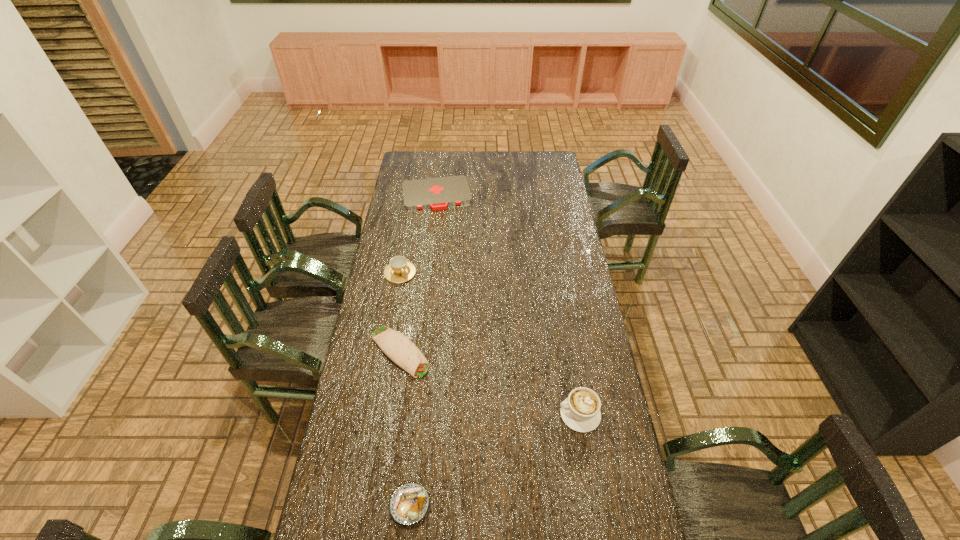
The height and width of the screenshot is (540, 960). What are the coordinates of `pastry` in the screenshot? It's located at (409, 503).

The width and height of the screenshot is (960, 540). In order to click on cappuccino in this screenshot , I will do `click(580, 411)`.

This screenshot has height=540, width=960. What are the coordinates of `the tallest object` in the screenshot? It's located at (580, 411).

Identify the location of the shortest object. The height and width of the screenshot is (540, 960). (438, 193).

Locate an element on the screen. the farthest object is located at coordinates (438, 193).

Locate an element on the screen. The width and height of the screenshot is (960, 540). burrito is located at coordinates (396, 346).

Locate an element on the screen. the fourth nearest object is located at coordinates (399, 270).

At what (x,y) coordinates should I click in order to perform the action: click on cup. Please return your answer as a coordinate pair (x, y). Looking at the image, I should click on (399, 270).

Locate an element on the screen. free space located on the right of the pastry is located at coordinates (492, 505).

What are the coordinates of `vacant space located 0.340m to the right of the cappuccino's handle` in the screenshot? It's located at point(458,414).